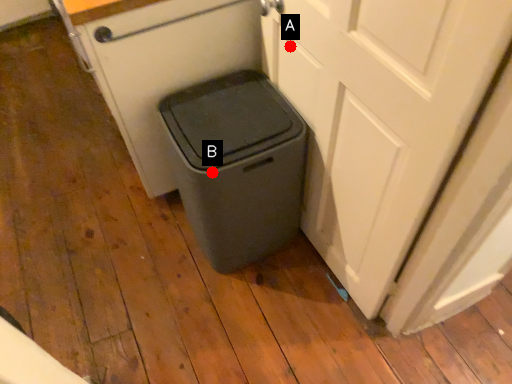
Question: Two points are circled on the image, labeled by A and B beside each circle. Among these points, which one is farthest from the camera?

Choices:
 (A) A is further
 (B) B is further

Answer: (A)